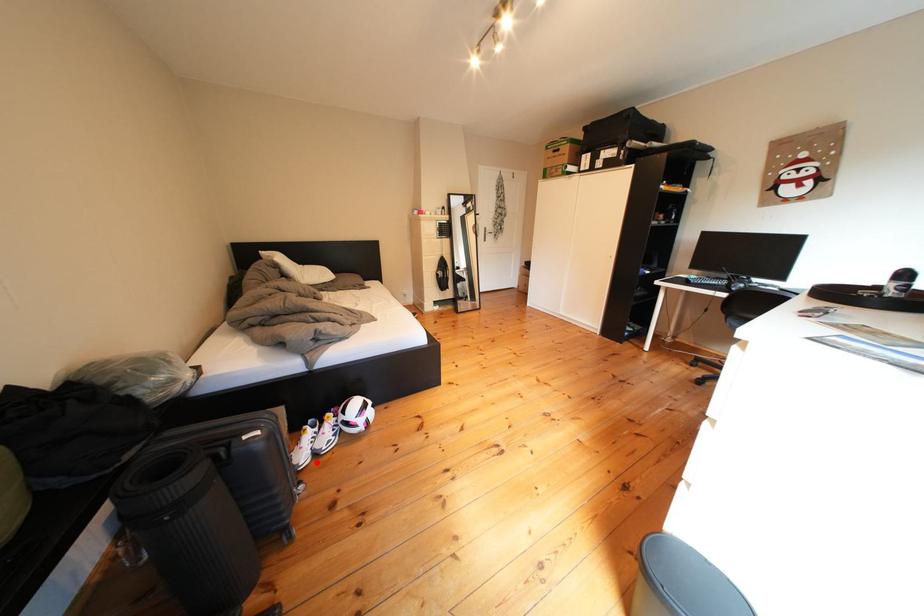
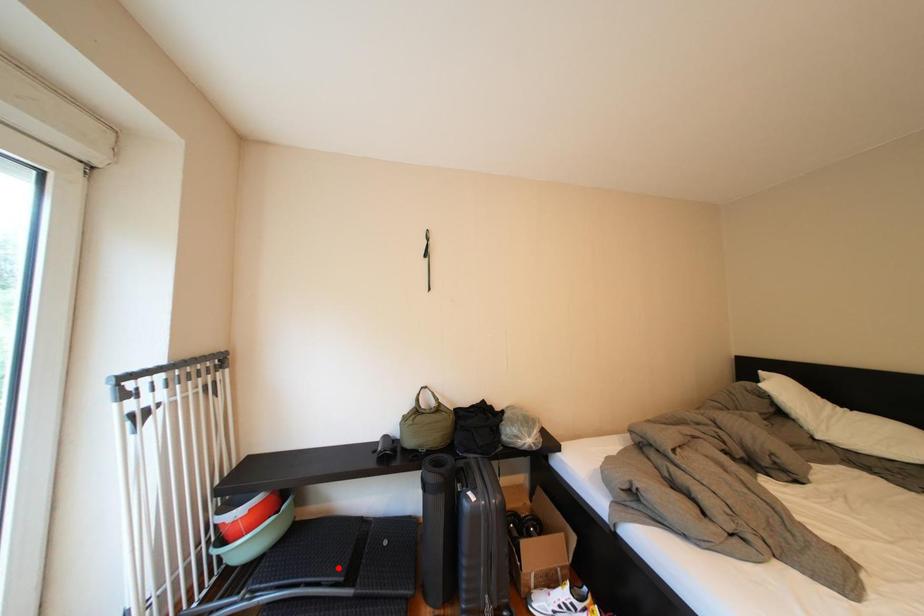
I am providing you with two images of the same scene from different viewpoints. A red point is marked on the first image and another point is marked on the second image. Do the highlighted points in image1 and image2 indicate the same real-world spot?

No